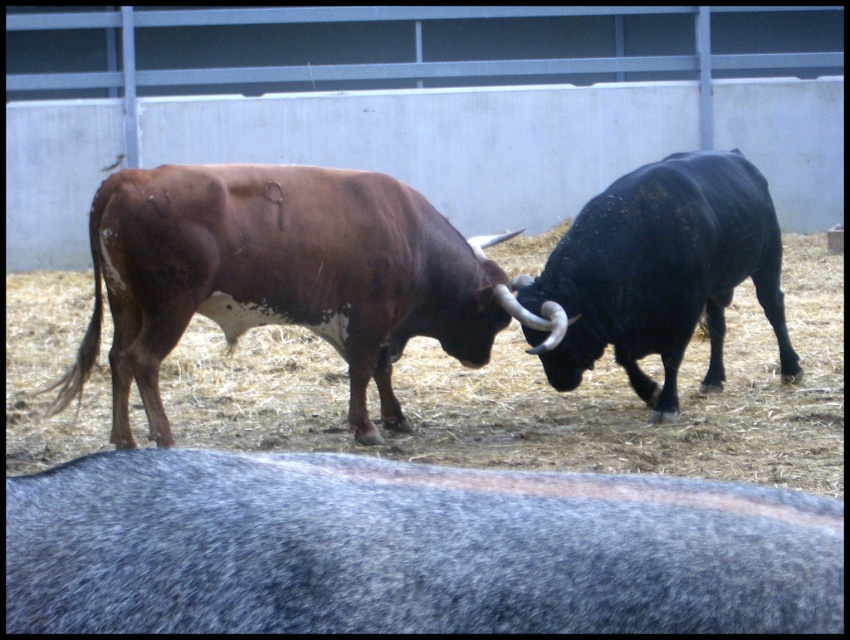
You are a farmer who needs to separate the gray woolen yak at lower center and the black glossy bull at right using a divider. The divider you have is 15 feet long. Will the divider be sufficient to place between them to separate them?

The gray woolen yak at lower center and the black glossy bull at right are 14.88 feet apart from each other. Since the divider is 15 feet long, it will be sufficient to place between them to separate them as it is slightly longer than the distance between them.

You are a farmer who wants to separate the gray woolen yak at lower center from the brown rough hide bull at center using a fence. Based on their positions, which animal would be closer to the fence if you place it between them?

The gray woolen yak at lower center is in front of the brown rough hide bull at center, so placing the fence between them would mean the gray woolen yak at lower center is closer to the fence.

You are a farmer who wants to place a new feeding trough at the exact center of the enclosure. Given the gray woolen yak at lower center is currently at coordinates point 0.859, 0.480, will the feeding trough be placed closer to the yak or farther away from it?

The feeding trough will be placed farther away from the gray woolen yak at lower center since the center of the enclosure is at point (425, 320), and the yak is at (408, 548), which is farther from the center.